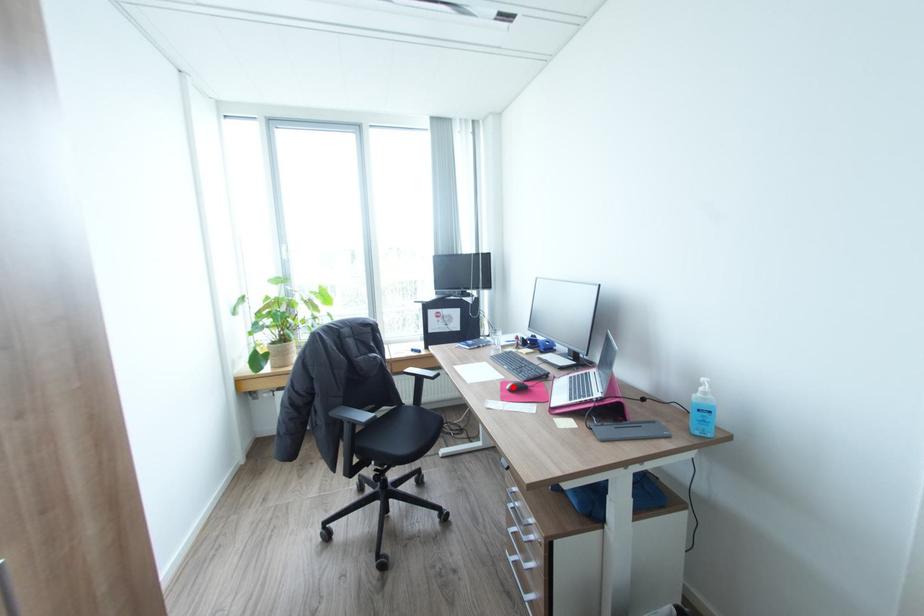
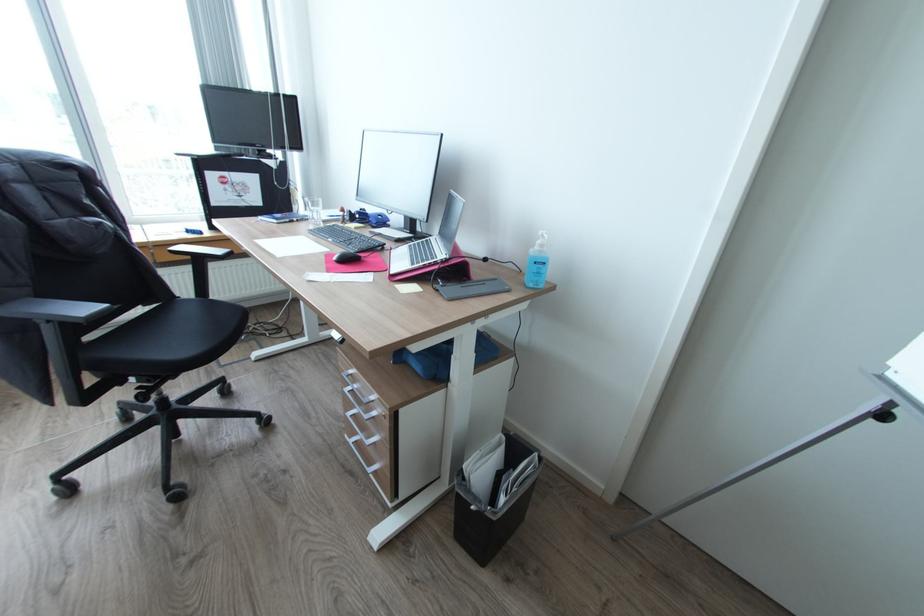
In the second image, find the point that corresponds to the highlighted location in the first image.

(339, 257)